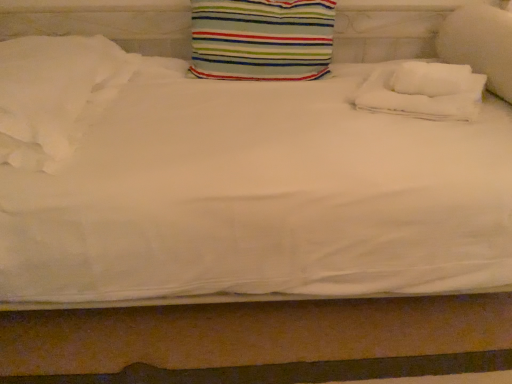
Question: From the image's perspective, relative to white soft pillow at left, which is the fourth pillow in right-to-left order, is white soft pillow at right, placed as the 4th pillow when sorted from left to right, above or below?

Choices:
 (A) above
 (B) below

Answer: (A)

Question: Considering the positions of white soft pillow at right, which is the 1th pillow in right-to-left order, and white soft pillow at left, placed as the 1th pillow when sorted from left to right, in the image, is white soft pillow at right, which is the 1th pillow in right-to-left order, bigger or smaller than white soft pillow at left, placed as the 1th pillow when sorted from left to right,?

Choices:
 (A) big
 (B) small

Answer: (B)

Question: Which object is positioned closest to the white soft pillow at right, which is the 1th pillow in right-to-left order?

Choices:
 (A) white soft pillow at left, which is the fourth pillow in right-to-left order
 (B) striped fabric pillow at center, positioned as the third pillow in right-to-left order
 (C) white soft towel at upper right, the 3th pillow when ordered from left to right

Answer: (C)

Question: Based on their relative distances, which object is nearer to the white soft pillow at right, placed as the 4th pillow when sorted from left to right?

Choices:
 (A) striped fabric pillow at center, positioned as the third pillow in right-to-left order
 (B) white soft pillow at left, placed as the 1th pillow when sorted from left to right
 (C) white soft towel at upper right, marked as the second pillow in a right-to-left arrangement

Answer: (C)